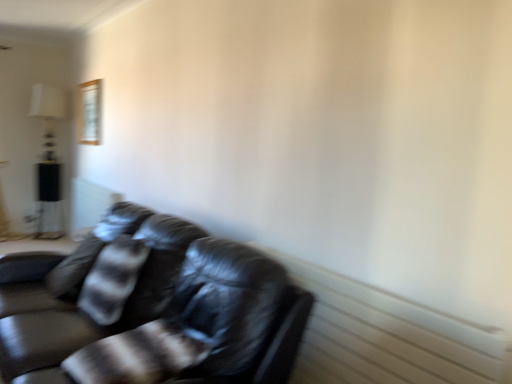
Question: Should I look upward or downward to see striped fabric pillow at left?

Choices:
 (A) up
 (B) down

Answer: (B)

Question: From the image's perspective, would you say white fabric lampshade at upper left is positioned over black glossy table at left?

Choices:
 (A) yes
 (B) no

Answer: (A)

Question: Is white fabric lampshade at upper left facing towards black glossy table at left?

Choices:
 (A) no
 (B) yes

Answer: (A)

Question: Does white fabric lampshade at upper left come behind black glossy table at left?

Choices:
 (A) no
 (B) yes

Answer: (A)

Question: Is white fabric lampshade at upper left outside black glossy table at left?

Choices:
 (A) no
 (B) yes

Answer: (B)

Question: Does white fabric lampshade at upper left have a smaller size compared to black glossy table at left?

Choices:
 (A) yes
 (B) no

Answer: (B)

Question: Is white fabric lampshade at upper left next to black glossy table at left?

Choices:
 (A) yes
 (B) no

Answer: (B)

Question: Does white fabric lampshade at upper left have a greater width compared to wooden frame at upper left?

Choices:
 (A) no
 (B) yes

Answer: (B)

Question: Considering the relative positions of white fabric lampshade at upper left and wooden frame at upper left in the image provided, is white fabric lampshade at upper left to the right of wooden frame at upper left from the viewer's perspective?

Choices:
 (A) no
 (B) yes

Answer: (A)

Question: Is white fabric lampshade at upper left bigger than wooden frame at upper left?

Choices:
 (A) yes
 (B) no

Answer: (A)

Question: From the image's perspective, is white fabric lampshade at upper left over wooden frame at upper left?

Choices:
 (A) yes
 (B) no

Answer: (B)

Question: Is white fabric lampshade at upper left turned away from wooden frame at upper left?

Choices:
 (A) no
 (B) yes

Answer: (A)

Question: From a real-world perspective, does white fabric lampshade at upper left sit lower than wooden frame at upper left?

Choices:
 (A) no
 (B) yes

Answer: (B)

Question: Is shiny black leather couch at lower left surrounding wooden frame at upper left?

Choices:
 (A) no
 (B) yes

Answer: (A)